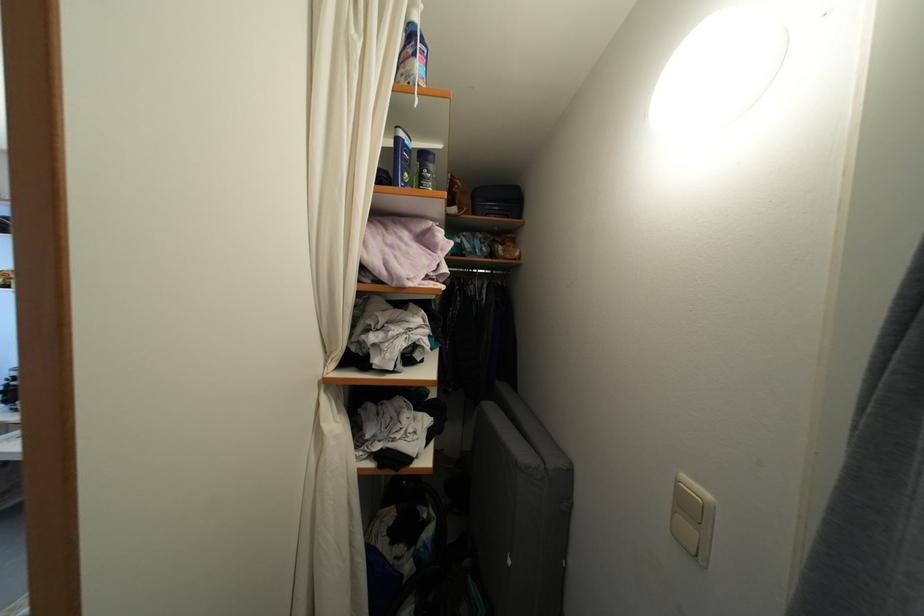
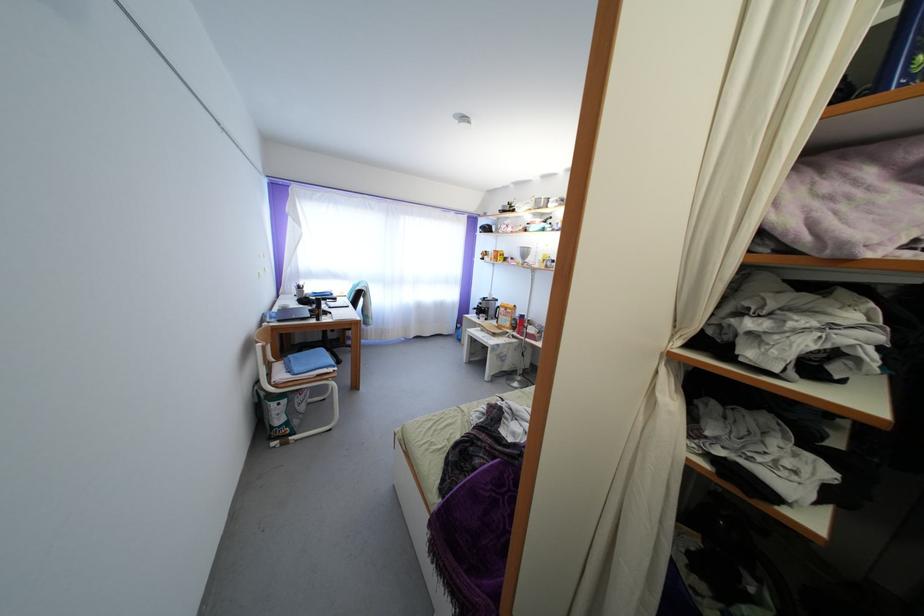
Question: The camera is either moving clockwise (left) or counter-clockwise (right) around the object. The first image is from the beginning of the video and the second image is from the end. Is the camera moving left or right when shooting the video?

Choices:
 (A) Left
 (B) Right

Answer: (B)